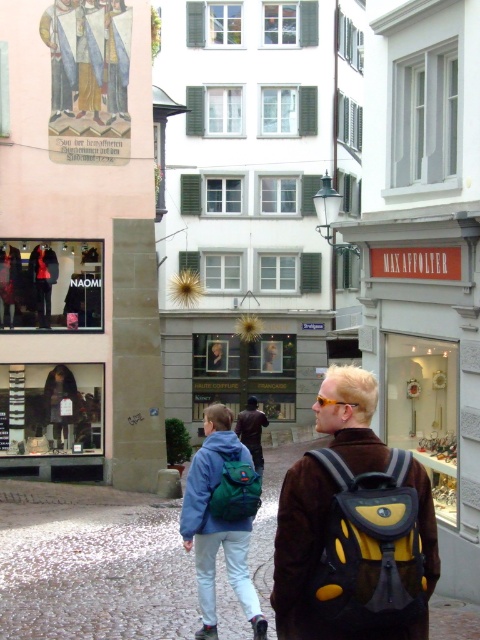
You are a traveler who wants to choose a backpack for a short trip. You see a yellow fabric backpack at center and a green fabric backpack at center. Which one has more space for your belongings?

The yellow fabric backpack at center is bigger than the green fabric backpack at center, so it has more space for your belongings.

You are a traveler trying to decide which backpack to take for your trip. You see a matte green backpack at center and a green fabric backpack at center. Which one has a larger width?

The matte green backpack at center has a larger width than the green fabric backpack at center according to the description.